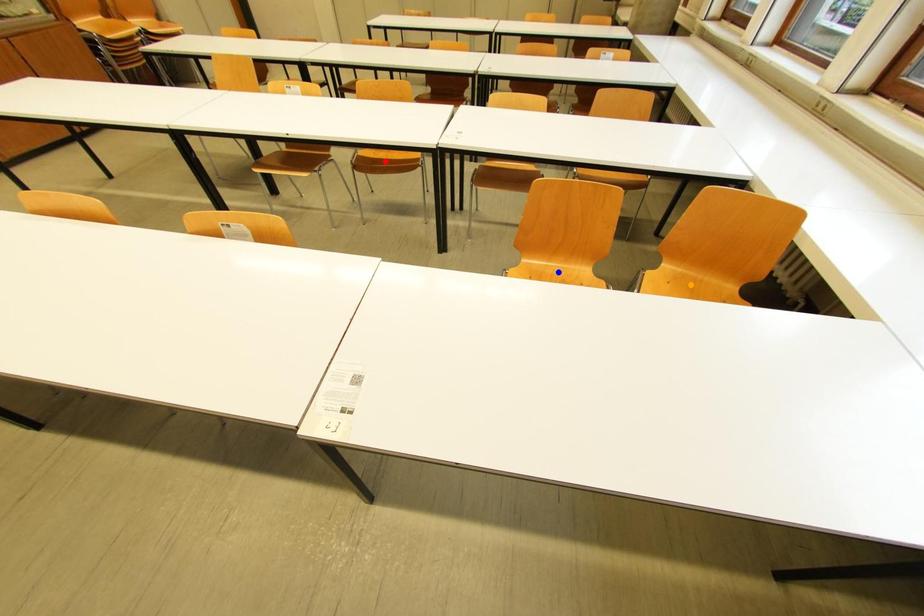
Consider the image. Order these from nearest to farthest:
- blue point
- red point
- orange point

1. blue point
2. orange point
3. red point